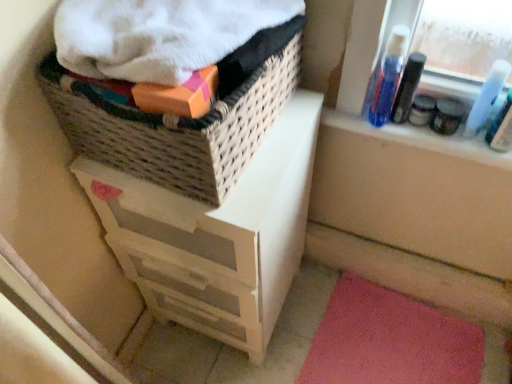
Identify the location of vacant point to the left of matte black container at upper right, which is the 1th toiletry from right to left. (383, 123).